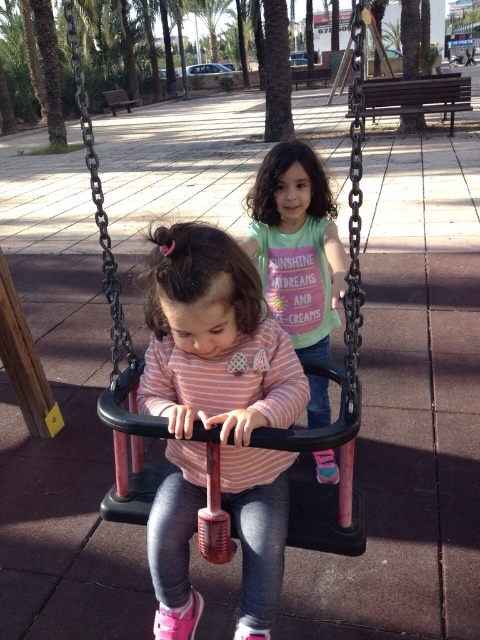
Who is lower down, pink striped shirt at center or black plastic swing at center?

pink striped shirt at center is lower down.

In order to click on pink striped shirt at center in this screenshot , I will do `click(216, 419)`.

Is black plastic swing at center thinner than matte pink shirt at center?

In fact, black plastic swing at center might be wider than matte pink shirt at center.

Can you confirm if black plastic swing at center is shorter than matte pink shirt at center?

No, black plastic swing at center is not shorter than matte pink shirt at center.

Is point (145, 476) more distant than point (317, 241)?

No, it is in front of (317, 241).

Locate an element on the screen. This screenshot has height=640, width=480. black plastic swing at center is located at coordinates (116, 346).

What do you see at coordinates (216, 419) in the screenshot? I see `pink striped shirt at center` at bounding box center [216, 419].

Which is in front, point (279, 586) or point (251, 216)?

Point (279, 586) is more forward.

Find the location of a particular element. The image size is (480, 640). pink striped shirt at center is located at coordinates (216, 419).